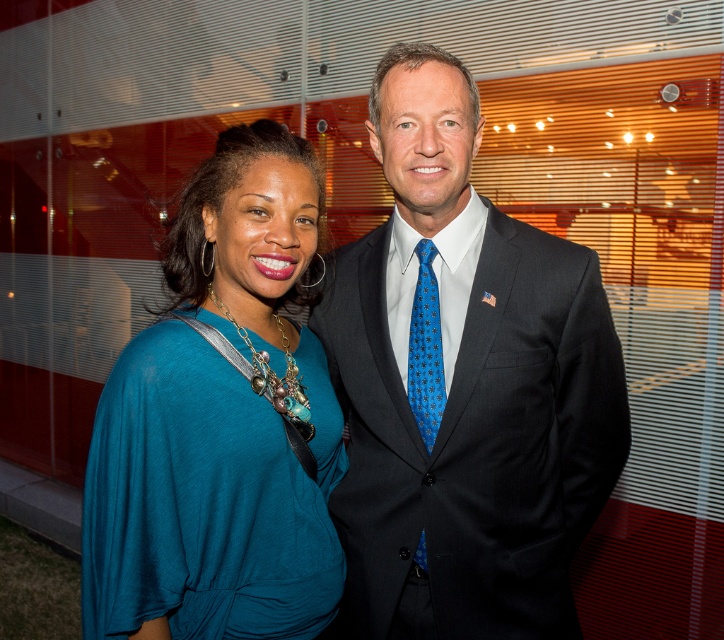
Which is below, dark gray suit at center or blue silk tie at center?

blue silk tie at center is below.

What do you see at coordinates (463, 385) in the screenshot? I see `dark gray suit at center` at bounding box center [463, 385].

Find the location of a particular element. The height and width of the screenshot is (640, 724). dark gray suit at center is located at coordinates (463, 385).

What do you see at coordinates (463, 385) in the screenshot? This screenshot has width=724, height=640. I see `dark gray suit at center` at bounding box center [463, 385].

Looking at this image, is dark gray suit at center smaller than teal fabric dress at center?

Incorrect, dark gray suit at center is not smaller in size than teal fabric dress at center.

The height and width of the screenshot is (640, 724). Find the location of `dark gray suit at center`. dark gray suit at center is located at coordinates (463, 385).

Who is lower down, teal fabric dress at center or blue silk tie at center?

blue silk tie at center is below.

Does point (321, 385) come in front of point (437, 352)?

No, it is behind (437, 352).

At what (x,y) coordinates should I click in order to perform the action: click on teal fabric dress at center. Please return your answer as a coordinate pair (x, y). The width and height of the screenshot is (724, 640). Looking at the image, I should click on (219, 422).